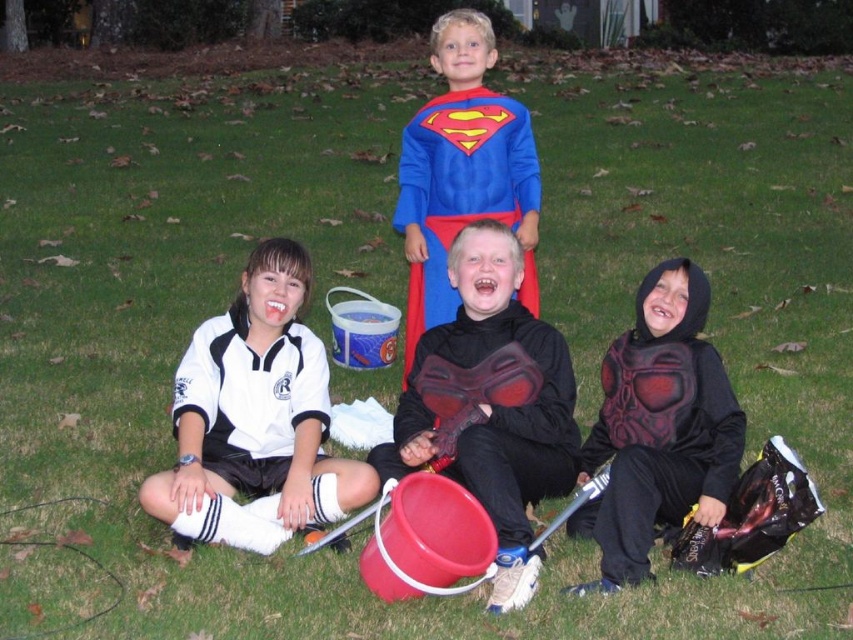
Is white jersey at center positioned at the back of black matte costume at lower right?

Yes, it is behind black matte costume at lower right.

Can you confirm if white jersey at center is positioned to the left of black matte costume at lower right?

Indeed, white jersey at center is positioned on the left side of black matte costume at lower right.

Which is behind, point (270, 353) or point (708, 426)?

Positioned behind is point (270, 353).

Where is `white jersey at center`? white jersey at center is located at coordinates (254, 419).

Can you confirm if white jersey at center is smaller than superman costume at center?

Indeed, white jersey at center has a smaller size compared to superman costume at center.

Between white jersey at center and superman costume at center, which one appears on the right side from the viewer's perspective?

superman costume at center

I want to click on white jersey at center, so click(254, 419).

Is rubberized black shield at center smaller than superman costume at center?

No, rubberized black shield at center is not smaller than superman costume at center.

Does rubberized black shield at center appear over superman costume at center?

No, rubberized black shield at center is not above superman costume at center.

Is point (556, 424) closer to viewer compared to point (529, 157)?

Yes, point (556, 424) is in front of point (529, 157).

You are a GUI agent. You are given a task and a screenshot of the screen. Output one action in this format:
    pyautogui.click(x=<x>, y=<y>)
    Task: Click on the rubberized black shield at center
    Image resolution: width=853 pixels, height=640 pixels.
    Given the screenshot: What is the action you would take?
    pyautogui.click(x=490, y=403)